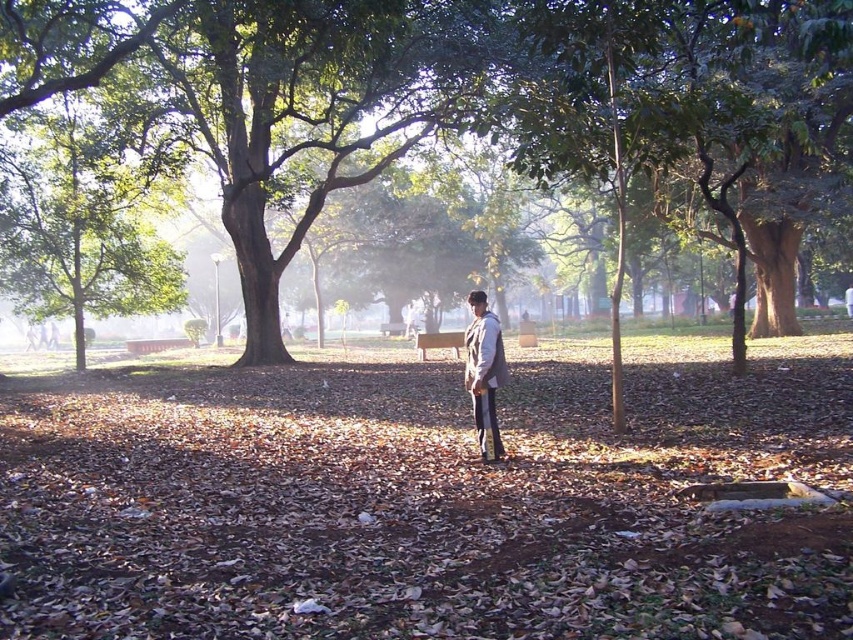
Question: Which point is closer to the camera taking this photo?

Choices:
 (A) (675, 106)
 (B) (496, 358)

Answer: (B)

Question: Among these points, which one is farthest from the camera?

Choices:
 (A) (549, 128)
 (B) (410, 532)

Answer: (A)

Question: Is brown matte ground at center below light brown leather jacket at center?

Choices:
 (A) no
 (B) yes

Answer: (B)

Question: Can you confirm if brown matte ground at center is positioned above green leafy tree at center?

Choices:
 (A) no
 (B) yes

Answer: (A)

Question: Can you confirm if brown matte ground at center is thinner than green leafy tree at center?

Choices:
 (A) no
 (B) yes

Answer: (A)

Question: Among these points, which one is farthest from the camera?

Choices:
 (A) 468,346
 (B) 35,29
 (C) 849,621

Answer: (B)